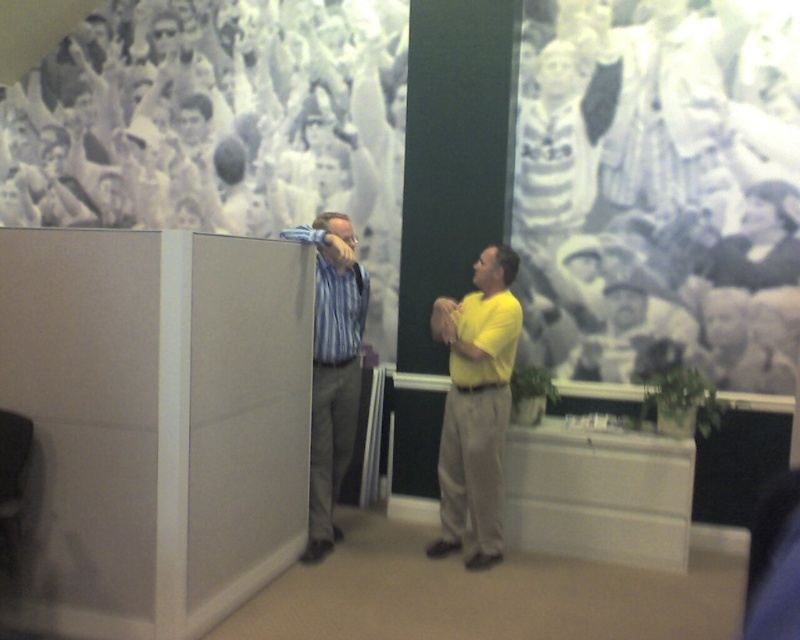
You are an assistant helping to organize a clothing donation drive. You have two items to sort out based on their height. The items are the blue striped dress shirt at left and the blue striped shirt at left. Which one should you place in the box labeled for taller clothing items?

The blue striped dress shirt at left has a greater height compared to the blue striped shirt at left, so you should place the blue striped dress shirt at left in the box labeled for taller clothing items.

Consider the image. You are an office assistant who needs to arrange chairs for a meeting. The chairs should be placed in front of the two people mentioned. According to the image, where should you place the chairs relative to the yellow matte shirt at center and the blue striped shirt at left?

The chairs should be placed in front of both the yellow matte shirt at center and the blue striped shirt at left. Since the yellow matte shirt at center is positioned under the blue striped shirt at left, the chair for the person in the blue striped shirt at left should be placed slightly behind the chair for the person in the yellow matte shirt at center to maintain proper alignment with their positions.

You are an event planner organizing a photo shoot in the described office. You need to place a large poster behind the yellow matte shirt at center and the blue striped shirt at left. Which person should the poster be placed behind to ensure it is visible to both individuals?

The poster should be placed behind the yellow matte shirt at center because it is larger in size than the blue striped shirt at left, making it more visible to both individuals.